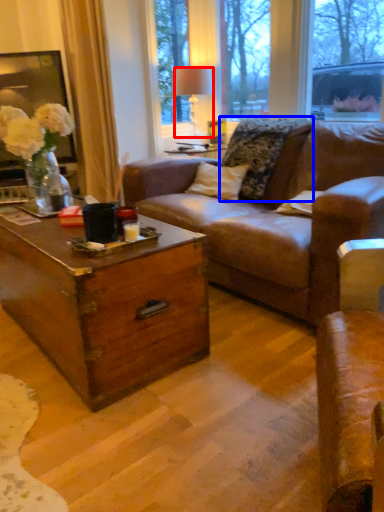
Question: Among these objects, which one is nearest to the camera, lamp (highlighted by a red box) or pillow (highlighted by a blue box)?

Choices:
 (A) lamp
 (B) pillow

Answer: (B)